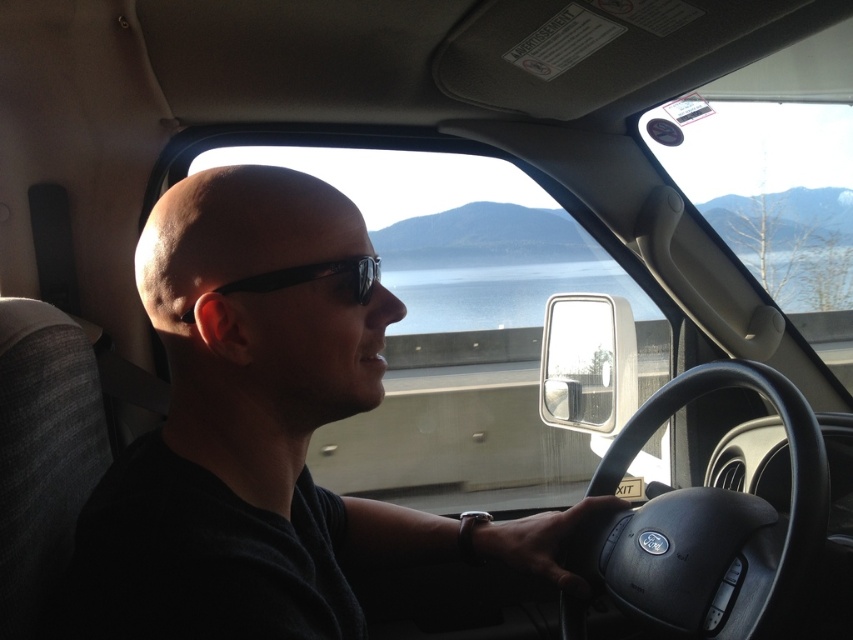
Question: Can you confirm if black matte steering wheel at center is positioned to the right of black plastic sunglasses at center?

Choices:
 (A) no
 (B) yes

Answer: (B)

Question: Based on their relative distances, which object is nearer to the black plastic sunglasses at center?

Choices:
 (A) black matte steering wheel at center
 (B) black matte shirt at center

Answer: (B)

Question: Can you confirm if black matte shirt at center is positioned below black plastic sunglasses at center?

Choices:
 (A) yes
 (B) no

Answer: (A)

Question: Which of the following is the farthest from the observer?

Choices:
 (A) (225, 285)
 (B) (685, 588)
 (C) (288, 506)

Answer: (B)

Question: Can you confirm if black matte shirt at center is thinner than black plastic sunglasses at center?

Choices:
 (A) no
 (B) yes

Answer: (A)

Question: Estimate the real-world distances between objects in this image. Which object is closer to the black matte steering wheel at center?

Choices:
 (A) black plastic sunglasses at center
 (B) black matte shirt at center

Answer: (B)